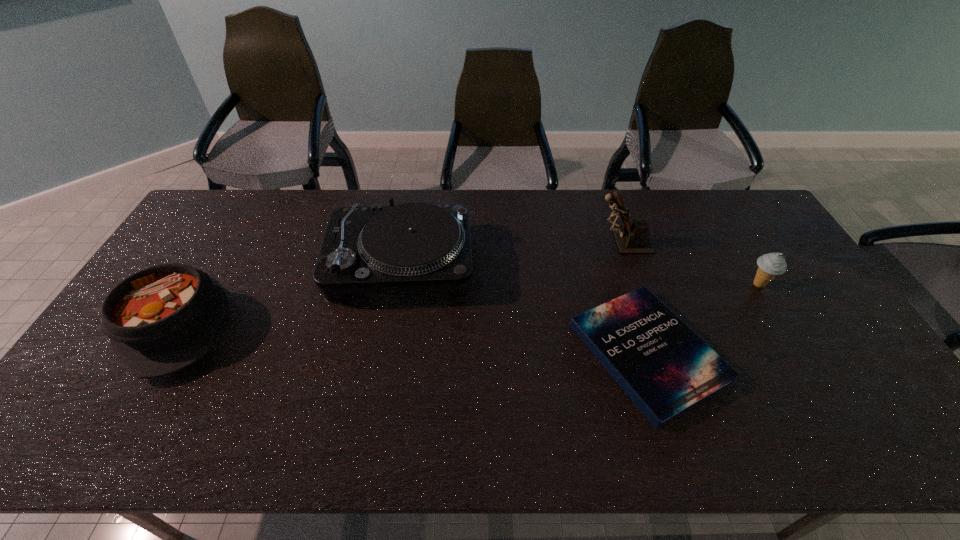
Identify the location of vacant region between the tallest object and the second object from left to right. This screenshot has height=540, width=960. (512, 252).

Identify which object is located as the nearest to the leftmost object. Please provide its 2D coordinates. Your answer should be formatted as a tuple, i.e. [(x, y)], where the tuple contains the x and y coordinates of a point satisfying the conditions above.

[(413, 246)]

Locate an element on the screen. This screenshot has width=960, height=540. object that is the fourth closest to the leftmost object is located at coordinates (771, 264).

Identify the location of free space that satisfies the following two spatial constraints: 1. on the front-facing side of the rightmost object; 2. on the right side of the tallest object. The image size is (960, 540). (636, 285).

Identify the location of free point that satisfies the following two spatial constraints: 1. on the front-facing side of the tallest object; 2. on the right side of the rightmost object. Image resolution: width=960 pixels, height=540 pixels. coord(636,285).

At what (x,y) coordinates should I click in order to perform the action: click on free space in the image that satisfies the following two spatial constraints: 1. on the front-facing side of the rightmost object; 2. on the right side of the tallest object. Please return your answer as a coordinate pair (x, y). This screenshot has width=960, height=540. Looking at the image, I should click on (636, 285).